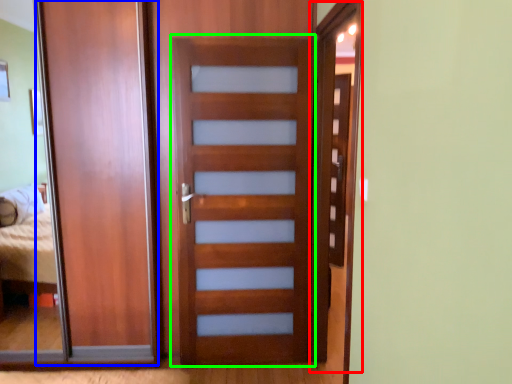
Question: Which is farther away from screen door (highlighted by a red box)? barn door (highlighted by a blue box) or screen door (highlighted by a green box)?

Choices:
 (A) barn door
 (B) screen door

Answer: (A)